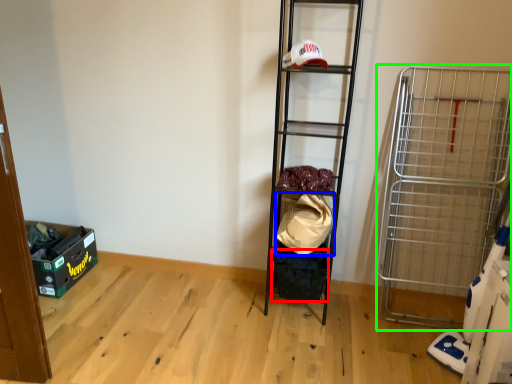
Question: Based on their relative distances, which object is farther from storage box (highlighted by a red box)? Choose from material (highlighted by a blue box) and cart (highlighted by a green box).

Choices:
 (A) material
 (B) cart

Answer: (B)